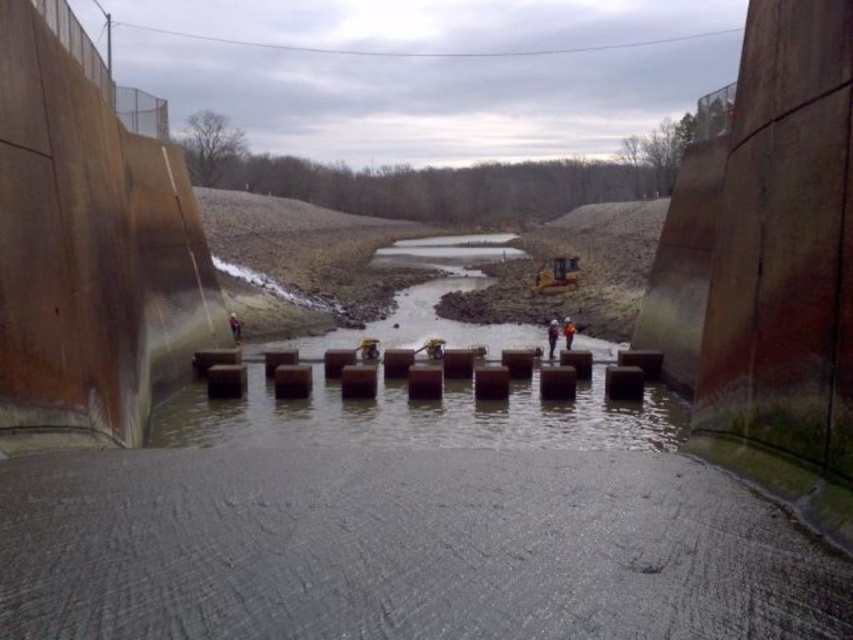
You are a safety inspector standing at the edge of the construction site. You see the white hard hat at center and the orange hard hat at center. Which hard hat is closer to you?

The white hard hat at center is closer to you because it is in front of the orange hard hat at center.

You are a construction worker who needs to place a tool on the ground between the white hard hat at center and the orange hard hat at center. Which hard hat is directly above the spot where you want to place your tool?

The orange hard hat at center is directly above the spot where you want to place your tool because the white hard hat at center is positioned under it.

You are a safety inspector at the dam construction site. You notice two hard hats lying on the wet concrete surface at the center. Which hard hat is taller between the white hard hat at center and the orange hard hat at center?

The white hard hat at center is taller than the orange hard hat at center.